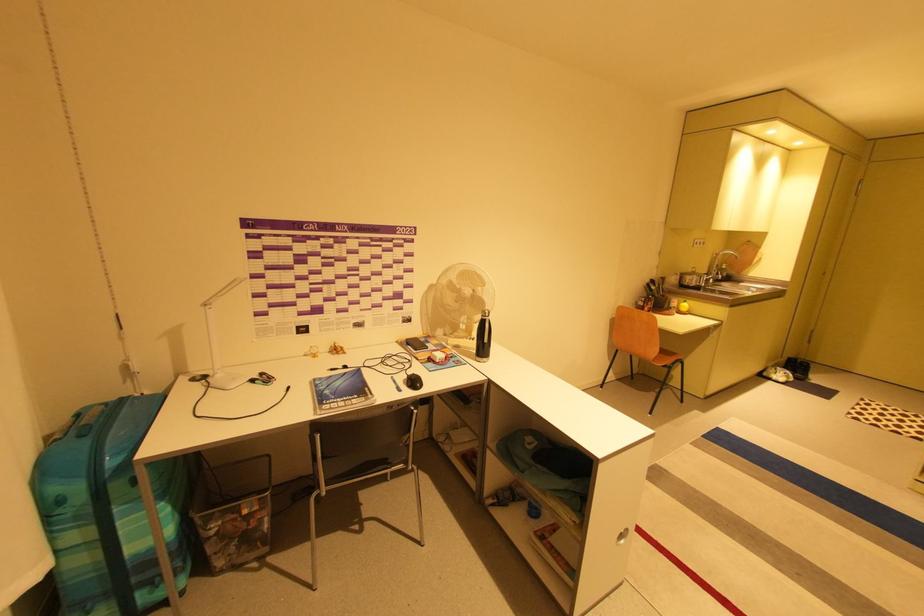
In order to click on black water bottle in this screenshot , I will do `click(482, 337)`.